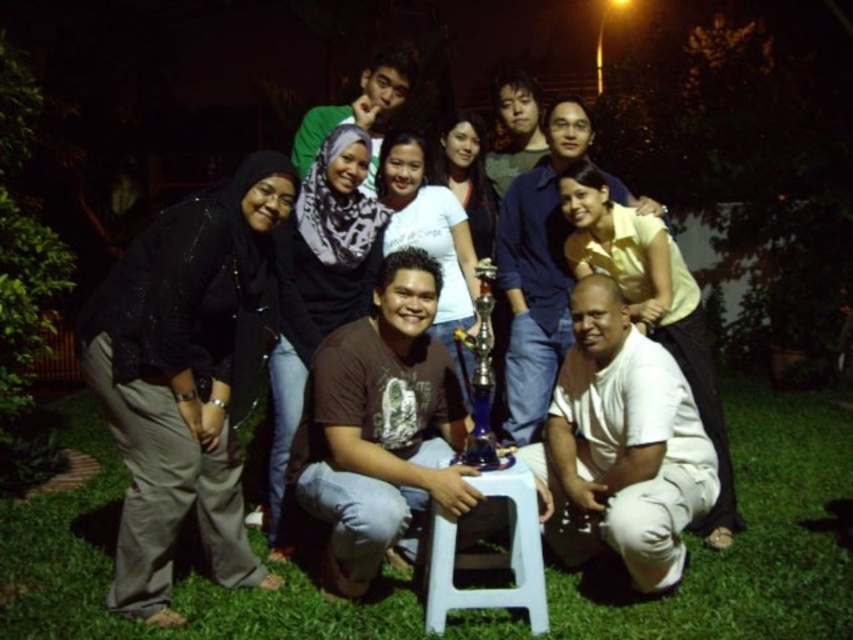
From the picture: Can you confirm if black matte pants at left is bigger than white plastic stool at center?

Yes.

Can you confirm if black matte pants at left is thinner than white plastic stool at center?

No, black matte pants at left is not thinner than white plastic stool at center.

Is point (131, 504) more distant than point (463, 566)?

No.

Where is `black matte pants at left`? The height and width of the screenshot is (640, 853). black matte pants at left is located at coordinates tap(186, 376).

Who is positioned more to the right, matte black shirt at center or white plastic stool at center?

white plastic stool at center is more to the right.

Can you confirm if matte black shirt at center is positioned to the left of white plastic stool at center?

Yes, matte black shirt at center is to the left of white plastic stool at center.

Looking at this image, who is more forward, (138, 364) or (437, 554)?

Point (138, 364) is in front.

Identify the location of matte black shirt at center. (207, 356).

Is green grass at lower center shorter than black matte pants at left?

Yes, green grass at lower center is shorter than black matte pants at left.

Describe the element at coordinates (753, 538) in the screenshot. I see `green grass at lower center` at that location.

Who is more forward, (x=612, y=608) or (x=234, y=218)?

Point (x=234, y=218)

You are a GUI agent. You are given a task and a screenshot of the screen. Output one action in this format:
    pyautogui.click(x=<x>, y=<y>)
    Task: Click on the green grass at lower center
    
    Given the screenshot: What is the action you would take?
    pyautogui.click(x=753, y=538)